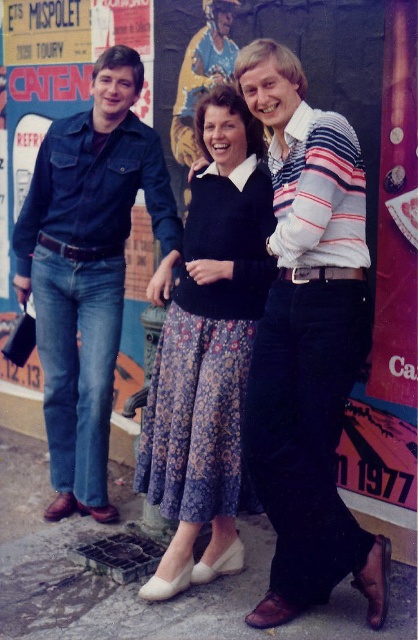
You are a photographer trying to adjust the lighting for a group photo. You notice the striped cotton shirt at center and the floral cotton dress at center. Which clothing item is closer to the camera?

The striped cotton shirt at center is in front of the floral cotton dress at center, so it is closer to the camera.

You are taking a photo of the striped cotton shirt at center and the denim jeans at left. Which one should you focus on first if you want to capture both clearly?

The striped cotton shirt at center should be focused on first because it is closer to the viewer than the denim jeans at left, ensuring both are in focus when using a shallow depth of field.